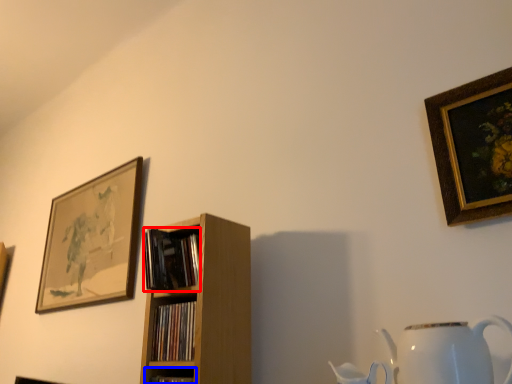
Question: Which of the following is the farthest to the observer, book (highlighted by a red box) or shelf (highlighted by a blue box)?

Choices:
 (A) book
 (B) shelf

Answer: (A)